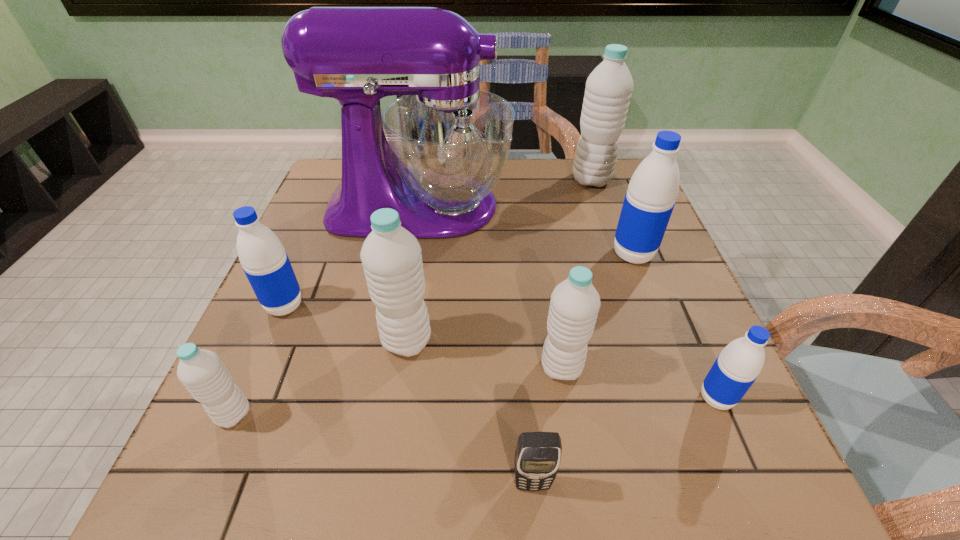
At what (x,y) coordinates should I click in order to perform the action: click on object that is at the far right corner. Please return your answer as a coordinate pair (x, y). Looking at the image, I should click on (608, 90).

Find the location of a particular element. vacant space at the far edge of the desktop is located at coordinates (551, 174).

Identify the location of free region at the near edge of the desktop. The image size is (960, 540). (477, 497).

In the image, there is a desktop. Where is `vacant region at the left edge`? This screenshot has height=540, width=960. vacant region at the left edge is located at coordinates (260, 312).

You are a GUI agent. You are given a task and a screenshot of the screen. Output one action in this format:
    pyautogui.click(x=<x>, y=<y>)
    Task: Click on the vacant space at the right edge
    This screenshot has width=960, height=540.
    Given the screenshot: What is the action you would take?
    pyautogui.click(x=682, y=413)

Locate an element on the screen. vacant region at the near left corner of the desktop is located at coordinates (190, 451).

You are a GUI agent. You are given a task and a screenshot of the screen. Output one action in this format:
    pyautogui.click(x=<x>, y=<y>)
    Task: Click on the empty location between the biggest blue water bottle and the second biggest blue water bottle
    
    Given the screenshot: What is the action you would take?
    pyautogui.click(x=459, y=280)

You are a GUI agent. You are given a task and a screenshot of the screen. Output one action in this format:
    pyautogui.click(x=<x>, y=<y>)
    Task: Click on the vacant space that is in between the nearest blue water bottle and the rightmost white water bottle
    The image size is (960, 540).
    Given the screenshot: What is the action you would take?
    pyautogui.click(x=654, y=289)

Find the location of a particular element. vacant point located between the tallest object and the nearest white water bottle is located at coordinates (326, 310).

The height and width of the screenshot is (540, 960). What are the coordinates of `vacant area that lies between the shortest object and the fourth farthest object` in the screenshot? It's located at (409, 394).